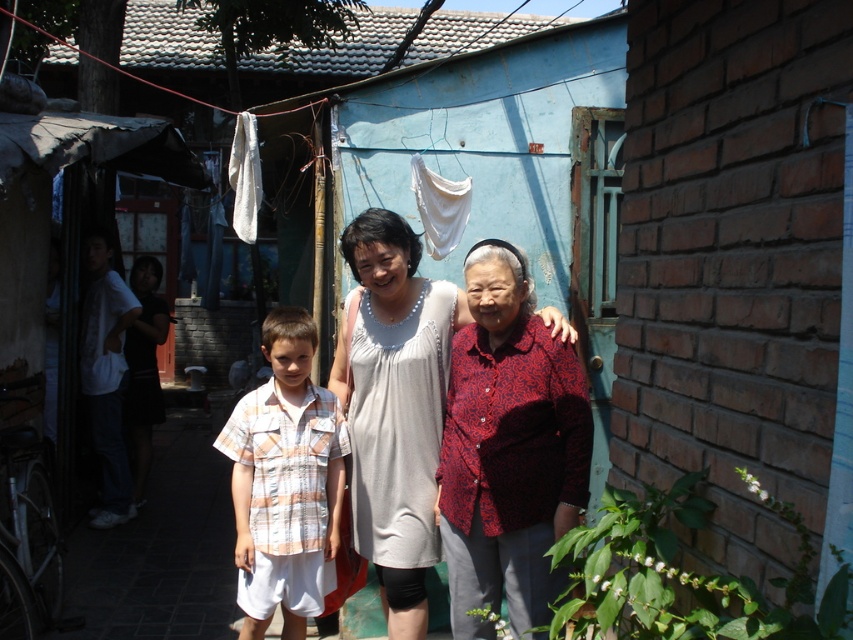
Question: Among these points, which one is nearest to the camera?

Choices:
 (A) (283, 588)
 (B) (576, 465)

Answer: (B)

Question: Is red patterned blouse at center bigger than striped cotton shirt at center?

Choices:
 (A) no
 (B) yes

Answer: (B)

Question: Is red patterned blouse at center to the right of striped cotton shirt at center from the viewer's perspective?

Choices:
 (A) yes
 (B) no

Answer: (A)

Question: Does red patterned blouse at center have a lesser width compared to striped cotton shirt at center?

Choices:
 (A) no
 (B) yes

Answer: (A)

Question: Which point is closer to the camera?

Choices:
 (A) striped cotton shirt at center
 (B) red patterned blouse at center

Answer: (B)